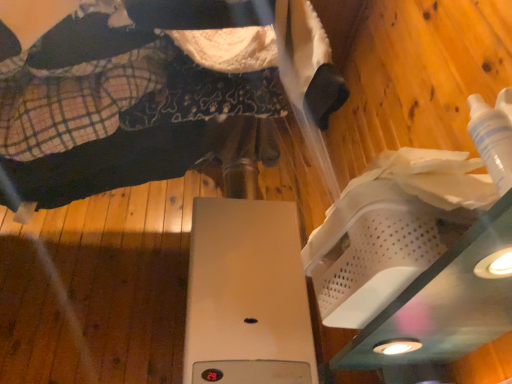
What is the approximate height of flannel fabric robe at upper left?

22.11 inches.

Find the location of a particular element. This screenshot has height=384, width=512. flannel fabric robe at upper left is located at coordinates (120, 93).

Image resolution: width=512 pixels, height=384 pixels. Describe the element at coordinates (120, 93) in the screenshot. I see `flannel fabric robe at upper left` at that location.

At what (x,y) coordinates should I click in order to perform the action: click on flannel fabric robe at upper left. Please return your answer as a coordinate pair (x, y). This screenshot has height=384, width=512. Looking at the image, I should click on (120, 93).